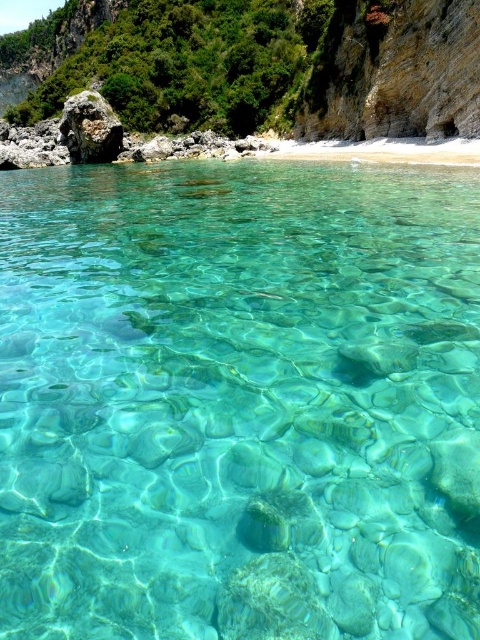
You are a hiker planning to climb both the rustic stone cliff at upper center and the rough textured rock at left. Based on their sizes, which one should you tackle first for a less challenging climb?

The rough textured rock at left should be tackled first since it is smaller than the rustic stone cliff at upper center, making it less challenging.

You are a hiker standing at the base of the rustic stone cliff at upper center. You want to climb to the top. Given that your average climbing pace is 0.5 meters per second, how long will it take you to reach the top?

The rustic stone cliff at upper center and viewer are 67.42 meters apart from each other. At a pace of 0.5 meters per second, it will take approximately 134.84 seconds, or about 2 minutes and 15 seconds, to reach the top.